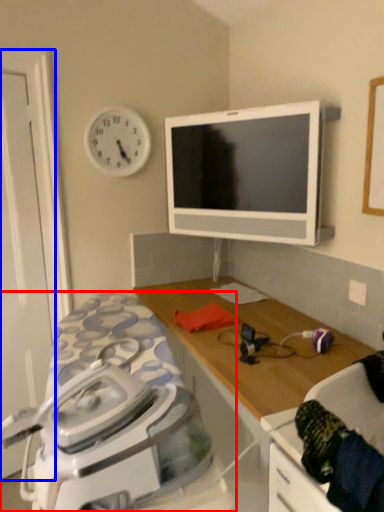
Question: Which object is closer to the camera taking this photo, home appliance (highlighted by a red box) or door (highlighted by a blue box)?

Choices:
 (A) home appliance
 (B) door

Answer: (A)